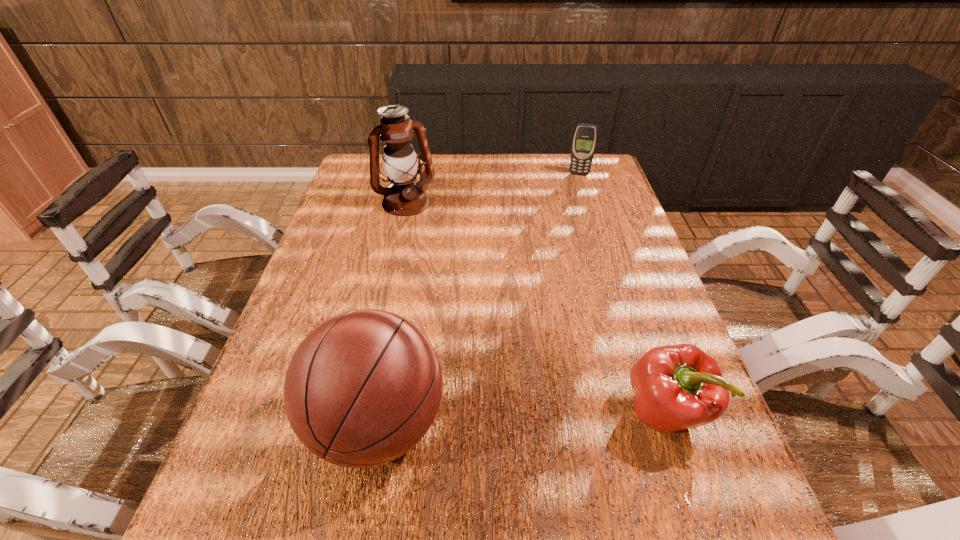
The width and height of the screenshot is (960, 540). In order to click on basketball in this screenshot , I will do `click(363, 388)`.

Locate an element on the screen. pepper is located at coordinates (677, 387).

Where is `cellular telephone`? cellular telephone is located at coordinates (585, 136).

Identify the location of the tallest object. (405, 196).

Locate an element on the screen. lantern is located at coordinates (405, 196).

The width and height of the screenshot is (960, 540). Identify the location of vacant space situated 0.180m on the right of the third shortest object. (541, 424).

Identify the location of vacant space located 0.230m on the left of the pepper. This screenshot has width=960, height=540. (507, 412).

You are a GUI agent. You are given a task and a screenshot of the screen. Output one action in this format:
    pyautogui.click(x=<x>, y=<y>)
    Task: Click on the vacant space positioned on the screen of the farthest object
    This screenshot has width=960, height=540.
    Given the screenshot: What is the action you would take?
    pyautogui.click(x=576, y=186)

Where is `free point located on the screen of the farthest object`? Image resolution: width=960 pixels, height=540 pixels. free point located on the screen of the farthest object is located at coordinates (576, 186).

In order to click on vacant space located 0.070m on the screen of the farthest object in this screenshot , I will do `click(576, 187)`.